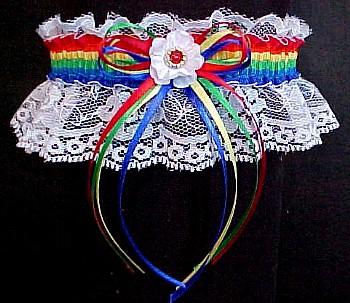
Where is `white faux flower`? This screenshot has width=350, height=303. white faux flower is located at coordinates (206, 122), (187, 70).